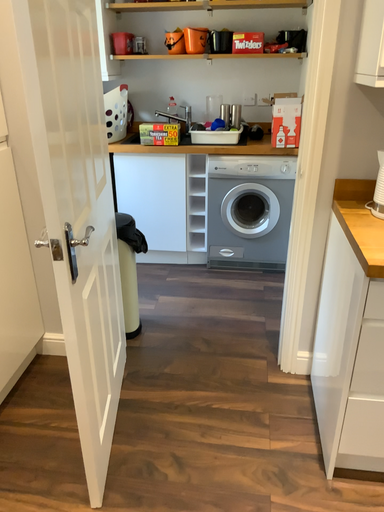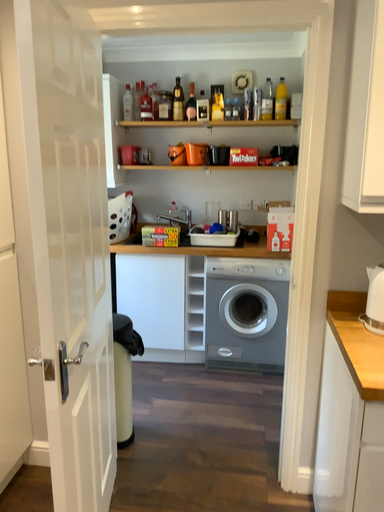
Question: How did the camera likely rotate when shooting the video?

Choices:
 (A) rotated downward
 (B) rotated upward

Answer: (B)